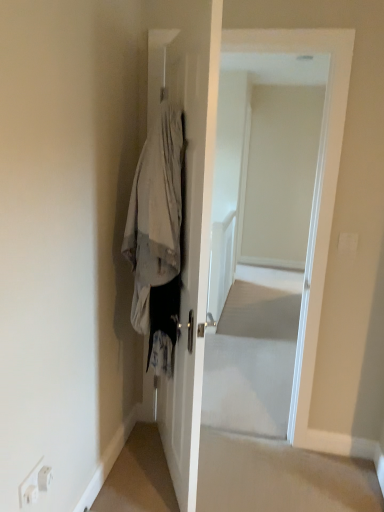
Question: Is point (273, 308) positioned closer to the camera than point (134, 243)?

Choices:
 (A) closer
 (B) farther

Answer: (B)

Question: Considering the positions of white glossy door at center and denim jacket at center in the image, is white glossy door at center taller or shorter than denim jacket at center?

Choices:
 (A) tall
 (B) short

Answer: (A)

Question: Looking at their shapes, would you say white glossy door at center is wider or thinner than denim jacket at center?

Choices:
 (A) thin
 (B) wide

Answer: (A)

Question: In terms of size, does denim jacket at center appear bigger or smaller than white glossy door at center?

Choices:
 (A) small
 (B) big

Answer: (A)

Question: Does point (152, 252) appear closer or farther from the camera than point (296, 272)?

Choices:
 (A) closer
 (B) farther

Answer: (A)

Question: Considering the positions of denim jacket at center and white glossy door at center in the image, is denim jacket at center taller or shorter than white glossy door at center?

Choices:
 (A) tall
 (B) short

Answer: (B)

Question: Would you say denim jacket at center is to the left or to the right of white glossy door at center in the picture?

Choices:
 (A) right
 (B) left

Answer: (B)